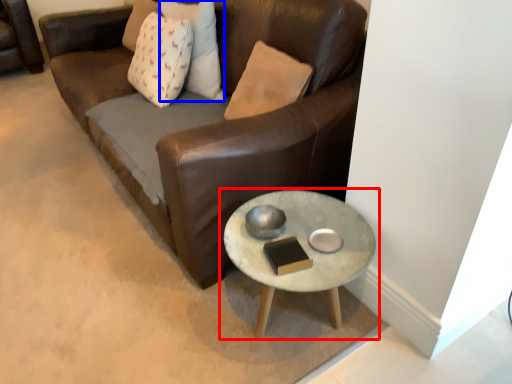
Question: Which of the following is the closest to the observer, coffee table (highlighted by a red box) or pillow (highlighted by a blue box)?

Choices:
 (A) coffee table
 (B) pillow

Answer: (A)